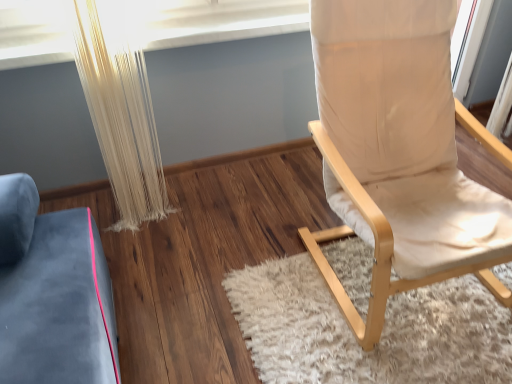
Where is `free space on the front side of white textured curtain at left`? The width and height of the screenshot is (512, 384). free space on the front side of white textured curtain at left is located at coordinates (151, 241).